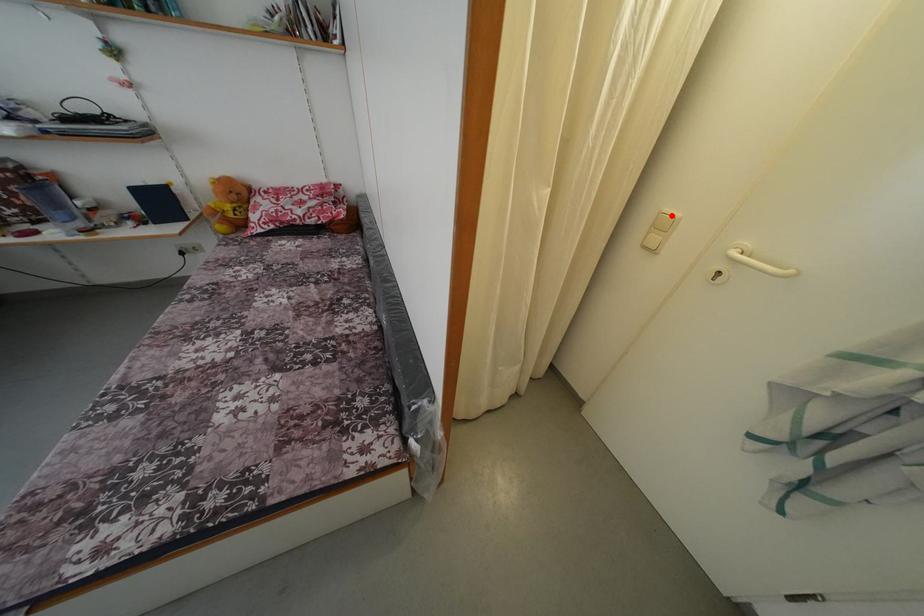
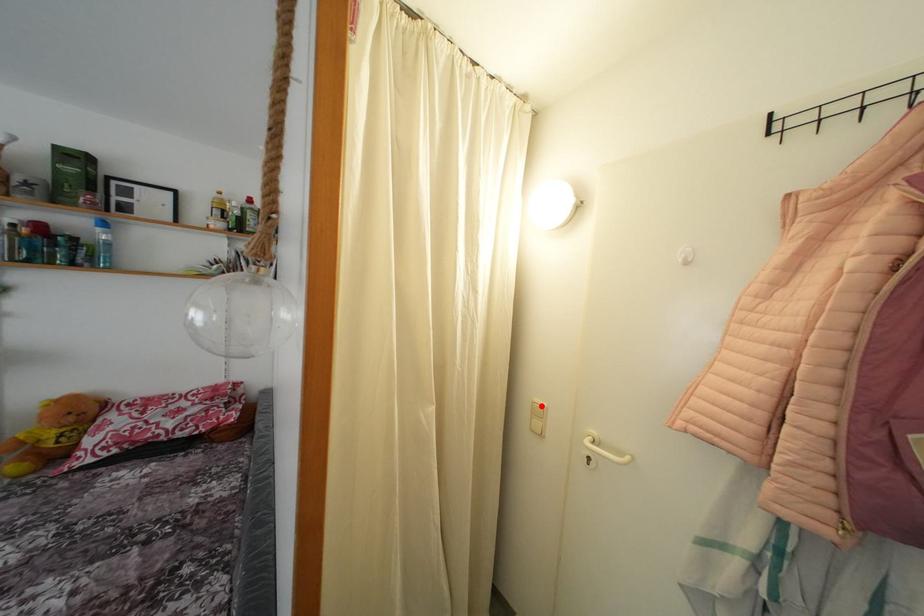
I am providing you with two images of the same scene from different viewpoints. A red point is marked on the first image and another point is marked on the second image. Is the red point in image1 aligned with the point shown in image2?

Yes